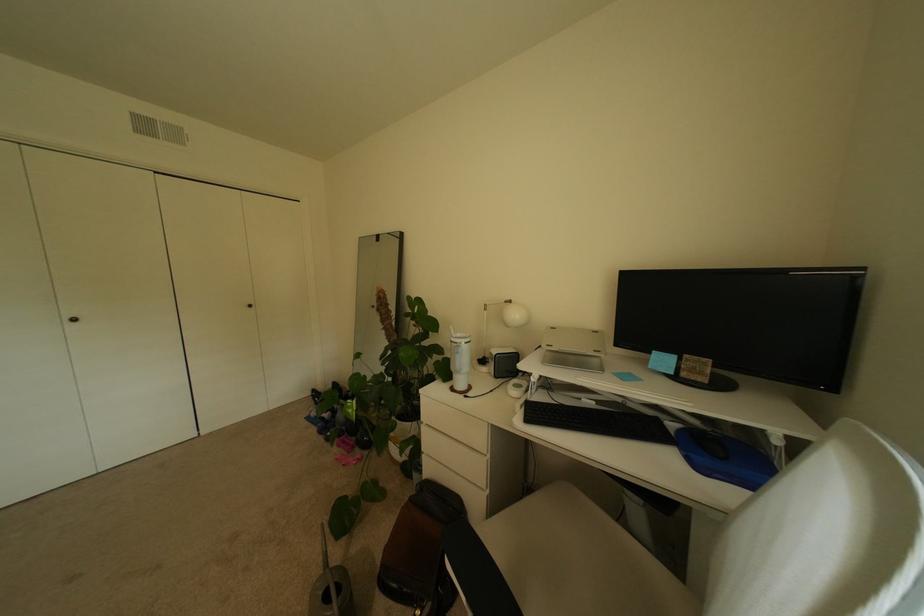
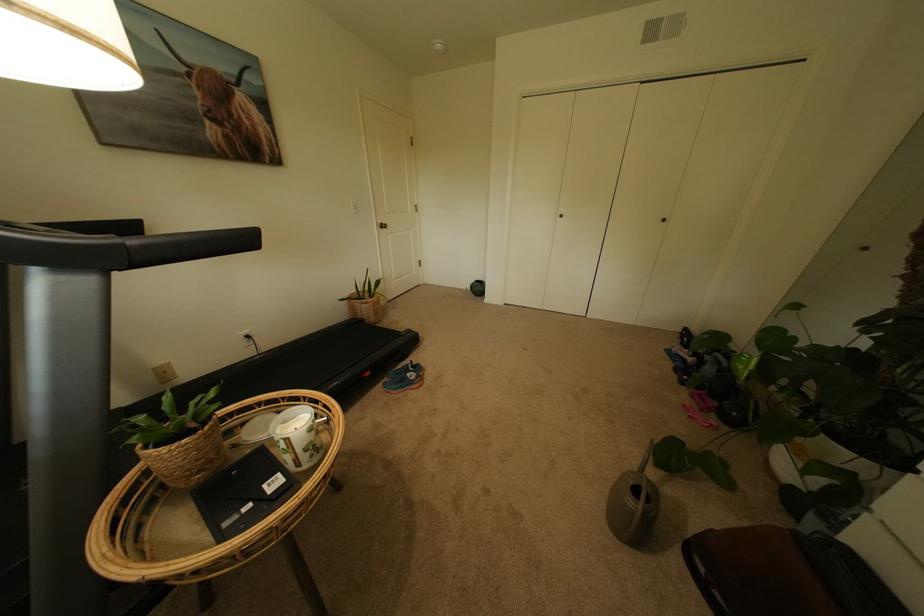
Based on the continuous images, in which direction is the camera rotating?

The camera's rotation is toward left-down.